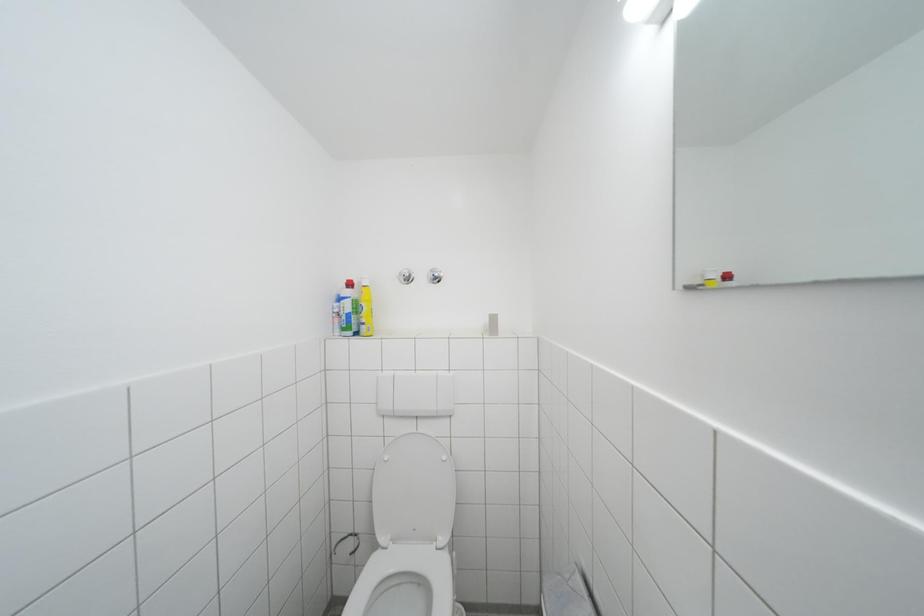
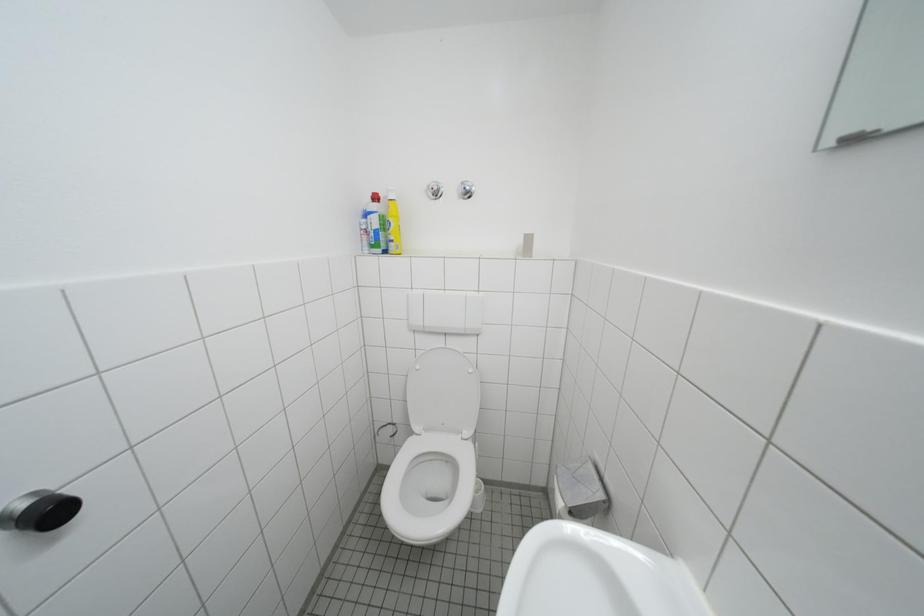
Question: The first image is from the beginning of the video and the second image is from the end. How did the camera likely rotate when shooting the video?

Choices:
 (A) Left
 (B) Right
 (C) Up
 (D) Down

Answer: (D)